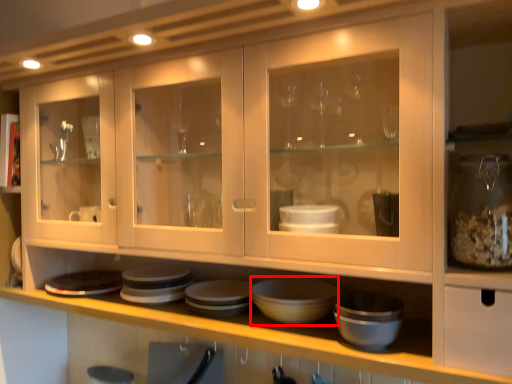
Question: Where is basin (annotated by the red box) located in relation to platter in the image?

Choices:
 (A) right
 (B) left

Answer: (A)